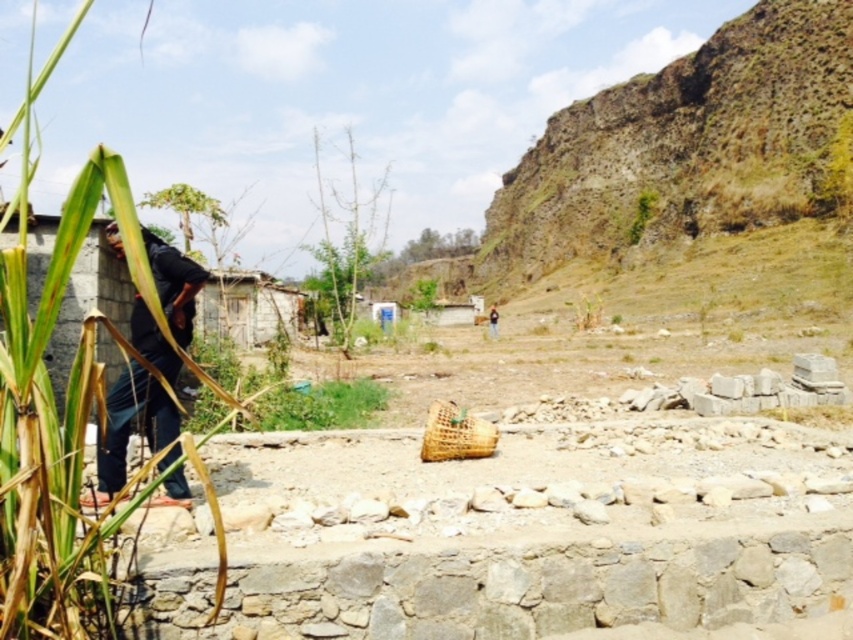
You are standing in the rural scene and want to know which object on the left side is wider between the green leafy reed at left and the dark blue jeans at left. Can you determine this?

The green leafy reed at left is wider than the dark blue jeans at left according to the description.

You are a gardener trying to plant a row of flowers in the green grass at center and the woven bamboo basket at center. Which area has enough space to accommodate the flowers if each flower requires 10 cm of width?

The green grass at center has a width that surpasses the woven bamboo basket at center, so the green grass at center can accommodate the flowers as it is wider than the basket.

You are standing in the rural outdoor scene described. You see a green leafy reed at left and dark blue jeans at left. Which object is taller?

The green leafy reed at left is taller than the dark blue jeans at left.